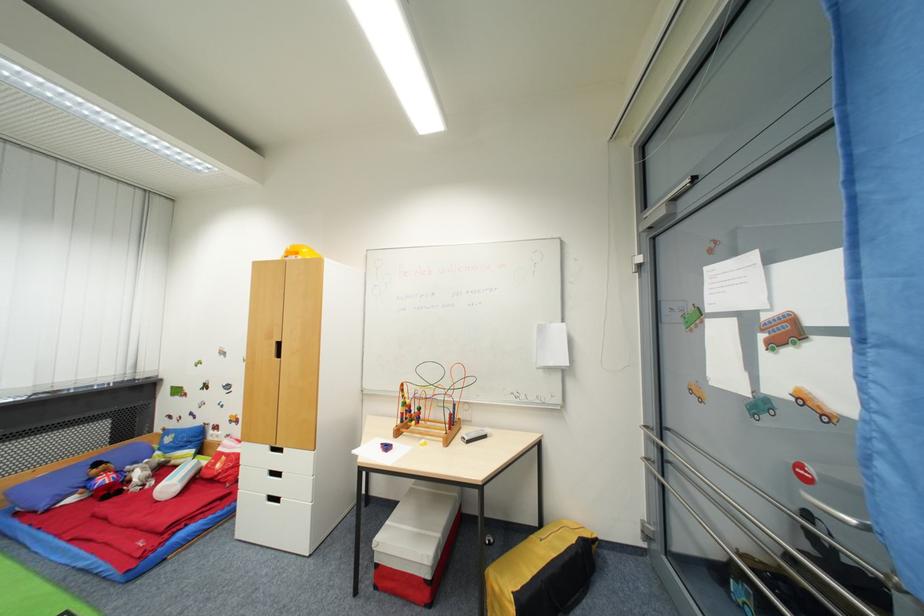
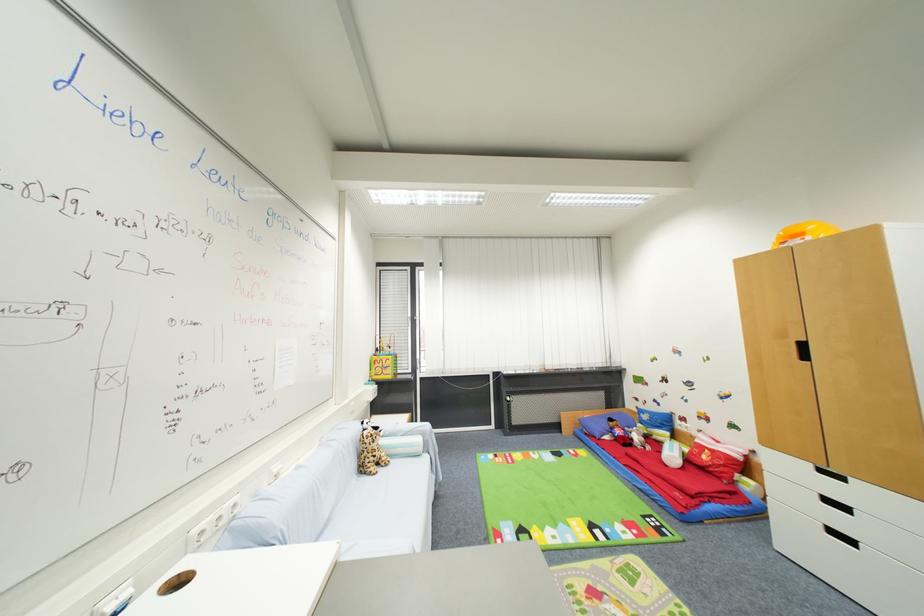
In the second image, find the point that corresponds to pixel 284 345 in the first image.

(808, 346)